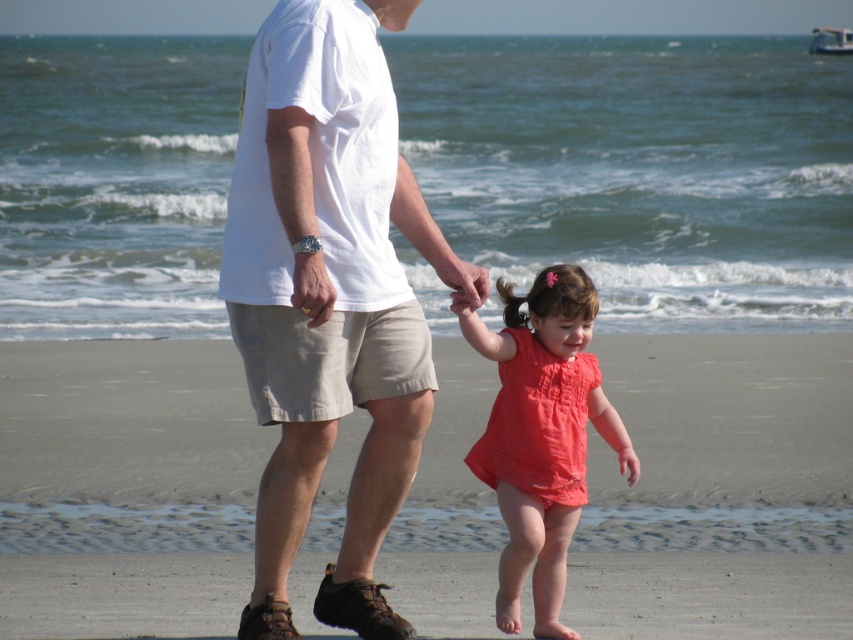
Is smooth sand at lower center positioned before matte skin hand at center?

That is False.

Describe the element at coordinates (718, 484) in the screenshot. Image resolution: width=853 pixels, height=640 pixels. I see `smooth sand at lower center` at that location.

Identify the location of smooth sand at lower center. This screenshot has height=640, width=853. (718, 484).

Is point (289, 28) closer to viewer compared to point (541, 324)?

Yes, point (289, 28) is in front of point (541, 324).

Does white cotton shirt at center come in front of matte coral dress at center?

Yes, it is in front of matte coral dress at center.

You are a GUI agent. You are given a task and a screenshot of the screen. Output one action in this format:
    pyautogui.click(x=<x>, y=<y>)
    Task: Click on the white cotton shirt at center
    
    Given the screenshot: What is the action you would take?
    pyautogui.click(x=326, y=296)

Measure the distance between matte coral dress at center and matte skin hand at center.

The distance of matte coral dress at center from matte skin hand at center is 29.28 inches.

Which is below, matte coral dress at center or matte skin hand at center?

matte coral dress at center

Who is more distant from viewer, (x=543, y=564) or (x=448, y=266)?

Positioned behind is point (x=543, y=564).

Locate an element on the screen. The height and width of the screenshot is (640, 853). matte coral dress at center is located at coordinates coord(541,433).